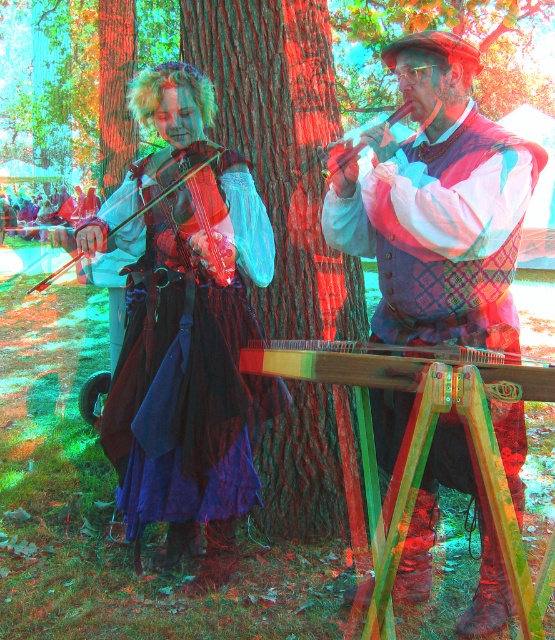
Between point (390, 372) and point (354, 148), which one is positioned behind?

Point (354, 148)

Is wooden harp at center below matte black violin at upper center?

Correct, wooden harp at center is located below matte black violin at upper center.

Is point (301, 378) behind point (408, 108)?

No, it is in front of (408, 108).

Identify the location of wooden harp at center. Image resolution: width=555 pixels, height=640 pixels. (391, 365).

Which of these two, matte black violin at left or matte black violin at upper center, stands shorter?

matte black violin at left is shorter.

Which is above, matte black violin at left or matte black violin at upper center?

matte black violin at upper center is higher up.

At what (x,y) coordinates should I click in order to perform the action: click on matte black violin at left. Please return your answer as a coordinate pair (x, y). This screenshot has height=640, width=555. Looking at the image, I should click on 174,184.

Locate an element on the screen. plaid fabric vest at center is located at coordinates (444, 234).

Between plaid fabric vest at center and velvet purple dress at center, which one is positioned lower?

plaid fabric vest at center

Find the location of a particular element. The height and width of the screenshot is (640, 555). plaid fabric vest at center is located at coordinates [x=444, y=234].